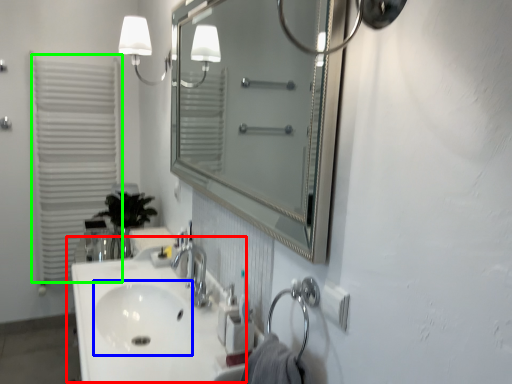
Question: Which object is positioned closest to sink (highlighted by a red box)? Select from sink (highlighted by a blue box) and shutter (highlighted by a green box).

Choices:
 (A) sink
 (B) shutter

Answer: (A)